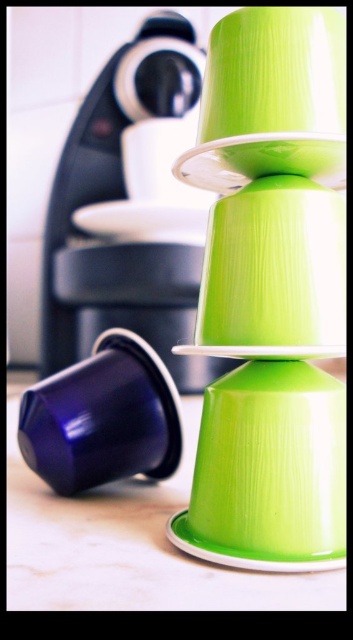
You are setting up a dining table and have placed a green matte plate at center and a white glossy saucer at center. If the table is 20 inches wide, will both items fit without overlapping?

The green matte plate at center and white glossy saucer at center are 18.65 inches apart, so they will fit on a 20 inch wide table without overlapping.

You are organizing a party and need to place a drink on the table. You have a green plastic cups at center and a matte blue cup at lower left. Which cup is positioned higher up on the table?

The green plastic cups at center is located above the matte blue cup at lower left, so it is positioned higher up on the table.

You are setting up a table for a coffee tasting event. You have a green plastic cups at center and a matte blue cup at lower left. Which cup should you move first to place them side by side on the table?

The green plastic cups at center should be moved first because it is currently in front of the matte blue cup at lower left, so moving it first will allow both cups to be placed side by side without obstruction.